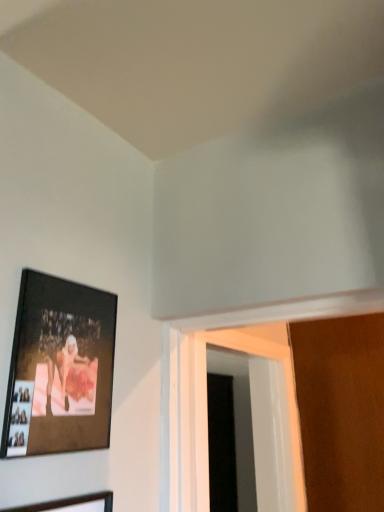
Question: Could you tell me if white plastic door at lower right is turned towards wooden picture frame at lower left, acting as the first picture frame starting from the bottom?

Choices:
 (A) no
 (B) yes

Answer: (A)

Question: Does white plastic door at lower right appear on the left side of wooden picture frame at lower left, acting as the first picture frame starting from the bottom?

Choices:
 (A) yes
 (B) no

Answer: (B)

Question: Does white plastic door at lower right have a greater height compared to wooden picture frame at lower left, acting as the first picture frame starting from the bottom?

Choices:
 (A) no
 (B) yes

Answer: (B)

Question: Is white plastic door at lower right surrounding wooden picture frame at lower left, the second picture frame from the top?

Choices:
 (A) no
 (B) yes

Answer: (A)

Question: Is white plastic door at lower right with wooden picture frame at lower left, the second picture frame from the top?

Choices:
 (A) no
 (B) yes

Answer: (A)

Question: In terms of height, does matte black picture frame at upper left, the first picture frame viewed from the top, look taller or shorter compared to wooden picture frame at lower left, the second picture frame from the top?

Choices:
 (A) tall
 (B) short

Answer: (B)

Question: Looking at their shapes, would you say matte black picture frame at upper left, the first picture frame viewed from the top, is wider or thinner than wooden picture frame at lower left, the second picture frame from the top?

Choices:
 (A) wide
 (B) thin

Answer: (A)

Question: From the image's perspective, is matte black picture frame at upper left, which is the second picture frame in bottom-to-top order, located above or below wooden picture frame at lower left, acting as the first picture frame starting from the bottom?

Choices:
 (A) above
 (B) below

Answer: (A)

Question: From a real-world perspective, is matte black picture frame at upper left, the first picture frame viewed from the top, positioned above or below wooden picture frame at lower left, the second picture frame from the top?

Choices:
 (A) above
 (B) below

Answer: (A)

Question: Do you think white plastic door at lower right is within matte black picture frame at upper left, the first picture frame viewed from the top, or outside of it?

Choices:
 (A) inside
 (B) outside

Answer: (B)

Question: Considering the relative positions of white plastic door at lower right and matte black picture frame at upper left, which is the second picture frame in bottom-to-top order, in the image provided, is white plastic door at lower right to the left or to the right of matte black picture frame at upper left, which is the second picture frame in bottom-to-top order,?

Choices:
 (A) left
 (B) right

Answer: (B)

Question: From a real-world perspective, is white plastic door at lower right positioned above or below matte black picture frame at upper left, the first picture frame viewed from the top?

Choices:
 (A) above
 (B) below

Answer: (B)

Question: From their relative heights in the image, would you say white plastic door at lower right is taller or shorter than matte black picture frame at upper left, which is the second picture frame in bottom-to-top order?

Choices:
 (A) short
 (B) tall

Answer: (B)

Question: Is wooden picture frame at lower left, the second picture frame from the top, bigger or smaller than white plastic door at lower right?

Choices:
 (A) small
 (B) big

Answer: (A)

Question: Considering their positions, is wooden picture frame at lower left, the second picture frame from the top, located in front of or behind white plastic door at lower right?

Choices:
 (A) behind
 (B) front

Answer: (B)